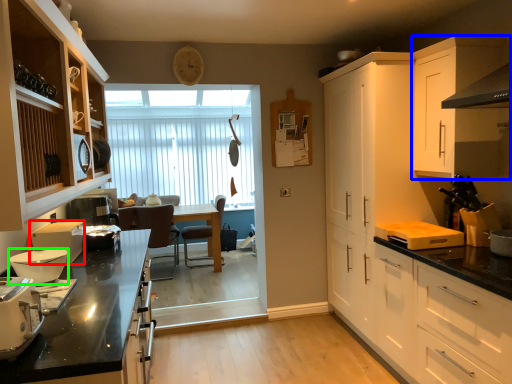
Question: Considering the real-world distances, which object is closest to kitchen appliance (highlighted by a red box)? cabinetry (highlighted by a blue box) or kitchen appliance (highlighted by a green box).

Choices:
 (A) cabinetry
 (B) kitchen appliance

Answer: (B)